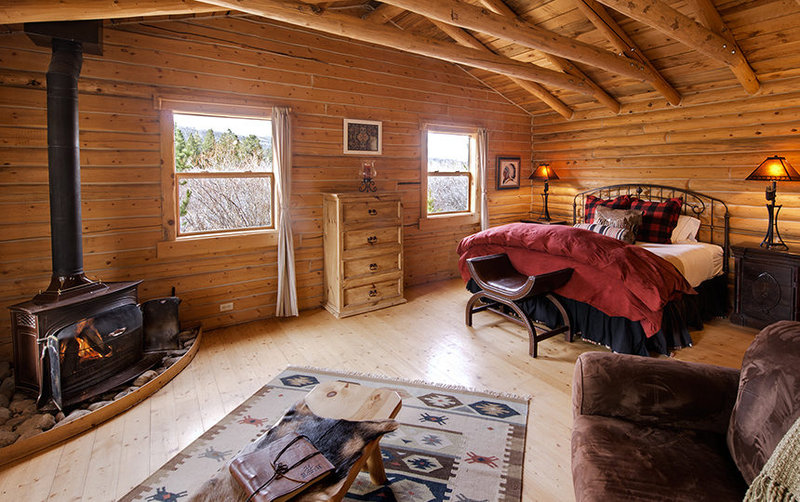
Locate an element on the screen. lamps is located at coordinates (546, 190), (772, 200).